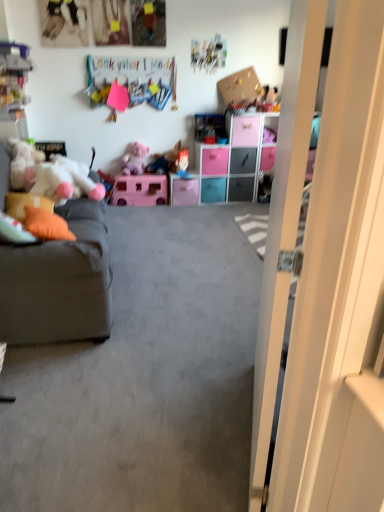
Question: Is orange fabric pillow at left, arranged as the 2th pillow when viewed from the left, far from plush mickey mouse at upper right, the fifth toy when ordered from front to back?

Choices:
 (A) yes
 (B) no

Answer: (A)

Question: From a real-world perspective, is orange fabric pillow at left, arranged as the 2th pillow when viewed from the left, over plush mickey mouse at upper right, which is counted as the first toy, starting from the back?

Choices:
 (A) no
 (B) yes

Answer: (A)

Question: Is the depth of orange fabric pillow at left, which appears as the first pillow when viewed from the right, greater than that of plush mickey mouse at upper right, which is counted as the first toy, starting from the back?

Choices:
 (A) yes
 (B) no

Answer: (B)

Question: Is orange fabric pillow at left, which appears as the first pillow when viewed from the right, oriented towards plush mickey mouse at upper right, marked as the fifth toy in a left-to-right arrangement?

Choices:
 (A) no
 (B) yes

Answer: (A)

Question: Is orange fabric pillow at left, arranged as the 2th pillow when viewed from the left, facing away from plush mickey mouse at upper right, which is counted as the first toy, starting from the back?

Choices:
 (A) yes
 (B) no

Answer: (B)

Question: Is blue plastic drawer at center, which is the 5th drawer from right to left, inside or outside of gray fabric couch at left?

Choices:
 (A) inside
 (B) outside

Answer: (B)

Question: From a real-world perspective, relative to gray fabric couch at left, is blue plastic drawer at center, which is the 5th drawer from right to left, vertically above or below?

Choices:
 (A) above
 (B) below

Answer: (B)

Question: In the image, is blue plastic drawer at center, which is the 5th drawer from right to left, positioned in front of or behind gray fabric couch at left?

Choices:
 (A) behind
 (B) front

Answer: (A)

Question: Does point (213, 180) appear closer or farther from the camera than point (92, 301)?

Choices:
 (A) farther
 (B) closer

Answer: (A)

Question: From the image's perspective, is plush mickey mouse at upper right, the fifth toy when ordered from front to back, located above or below white plush toy at left, the 5th toy when ordered from back to front?

Choices:
 (A) above
 (B) below

Answer: (A)

Question: Is plush mickey mouse at upper right, which ranks as the first toy in right-to-left order, situated inside white plush toy at left, the 5th toy when ordered from back to front, or outside?

Choices:
 (A) outside
 (B) inside

Answer: (A)

Question: From a real-world perspective, relative to white plush toy at left, the 5th toy when ordered from back to front, is plush mickey mouse at upper right, which is counted as the first toy, starting from the back, vertically above or below?

Choices:
 (A) below
 (B) above

Answer: (B)

Question: Considering the positions of plush mickey mouse at upper right, which is counted as the first toy, starting from the back, and white plush toy at left, acting as the 5th toy starting from the right, in the image, is plush mickey mouse at upper right, which is counted as the first toy, starting from the back, taller or shorter than white plush toy at left, acting as the 5th toy starting from the right,?

Choices:
 (A) tall
 (B) short

Answer: (B)

Question: Considering their positions, is pink plastic drawer at center, marked as the 6th drawer in a right-to-left arrangement, located in front of or behind plush pink teddy bear at center, placed as the 2th toy when sorted from left to right?

Choices:
 (A) behind
 (B) front

Answer: (A)

Question: Visually, is pink plastic drawer at center, arranged as the first drawer when viewed from the left, positioned to the left or to the right of plush pink teddy bear at center, arranged as the second toy when viewed from the front?

Choices:
 (A) left
 (B) right

Answer: (B)